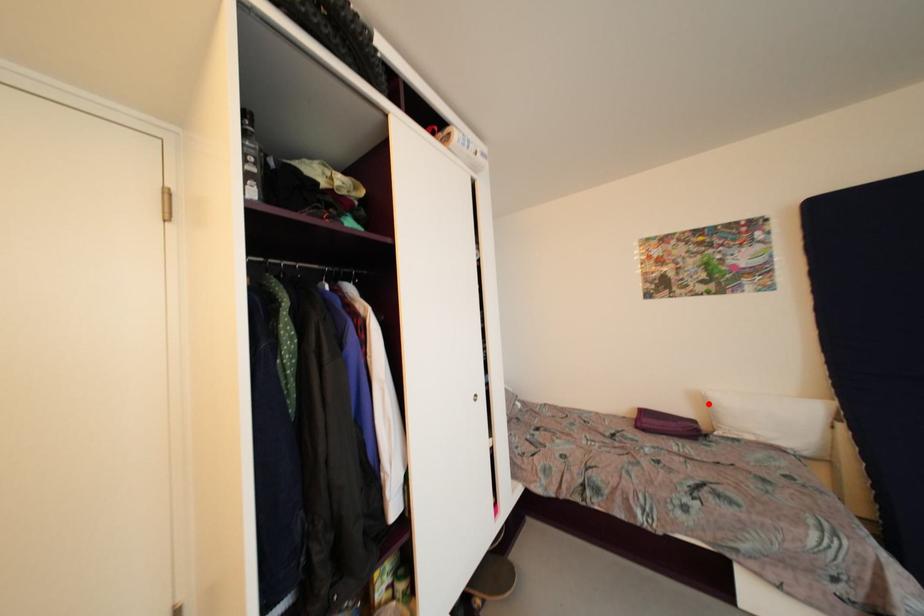
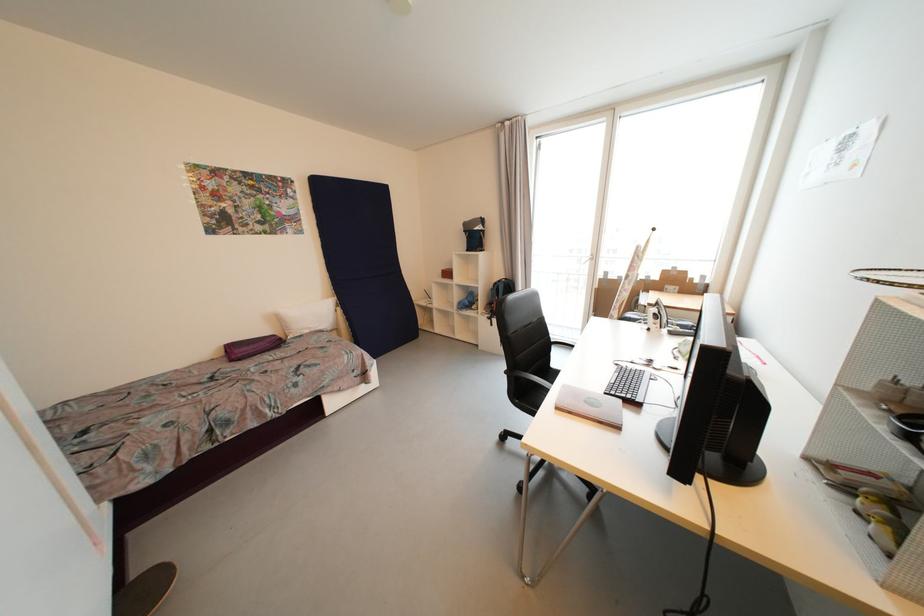
Find the pixel in the second image that matches the highlighted location in the first image.

(283, 321)